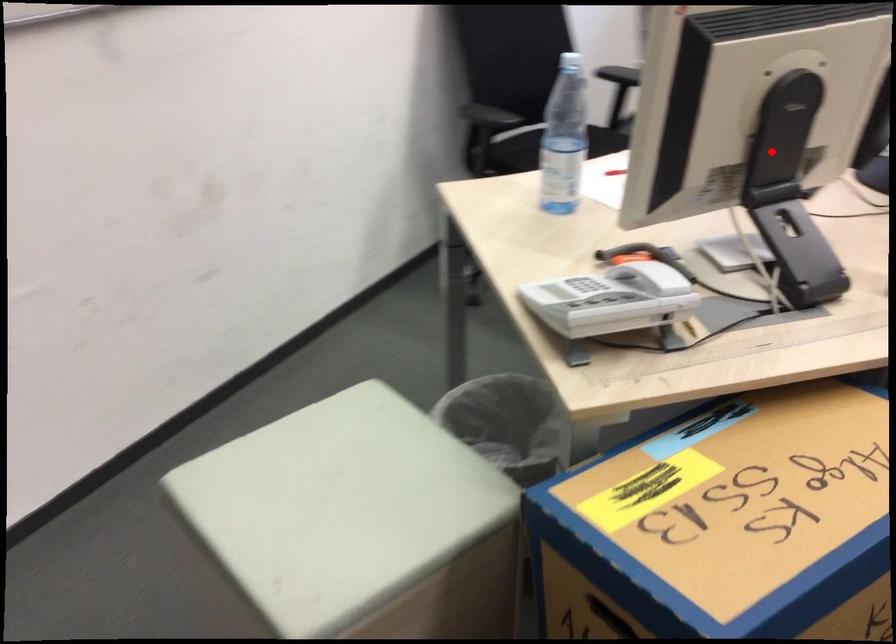
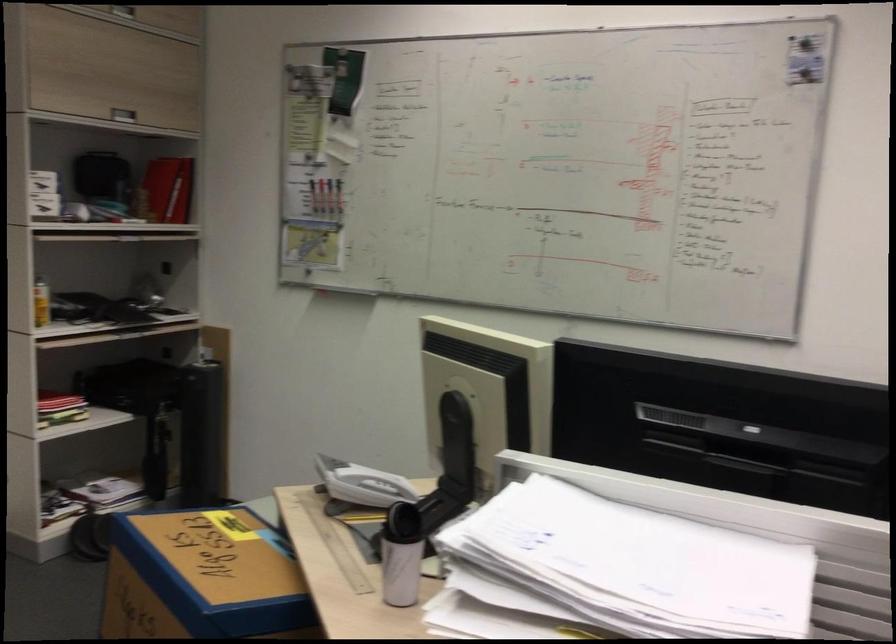
Where in the second image is the point corresponding to the highlighted location from the first image?

(457, 453)